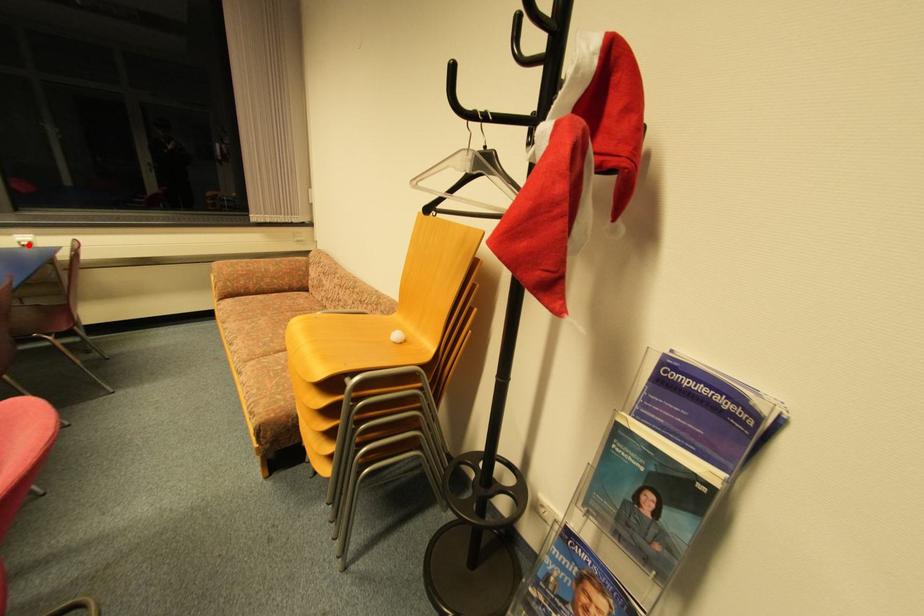
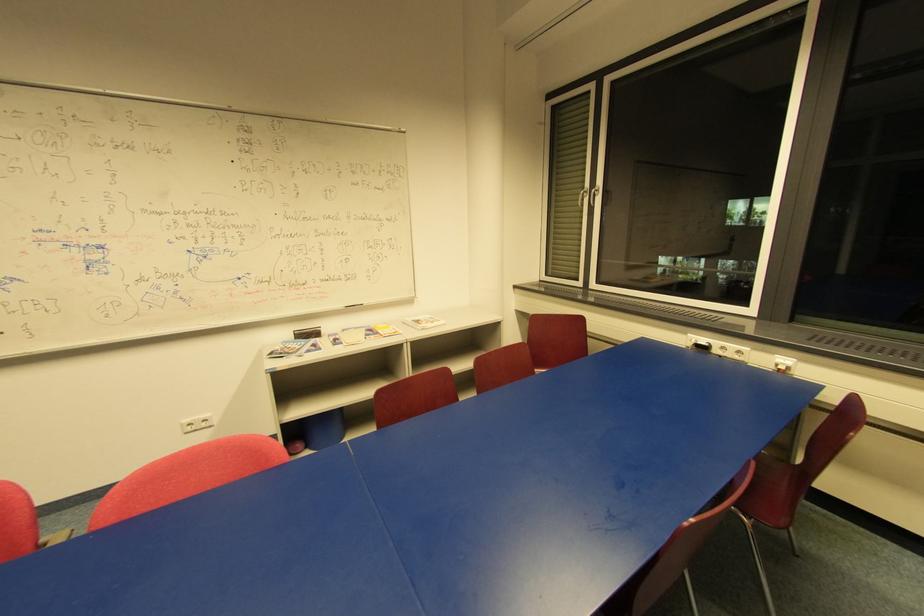
The point at the highlighted location is marked in the first image. Where is the corresponding point in the second image?

(785, 369)